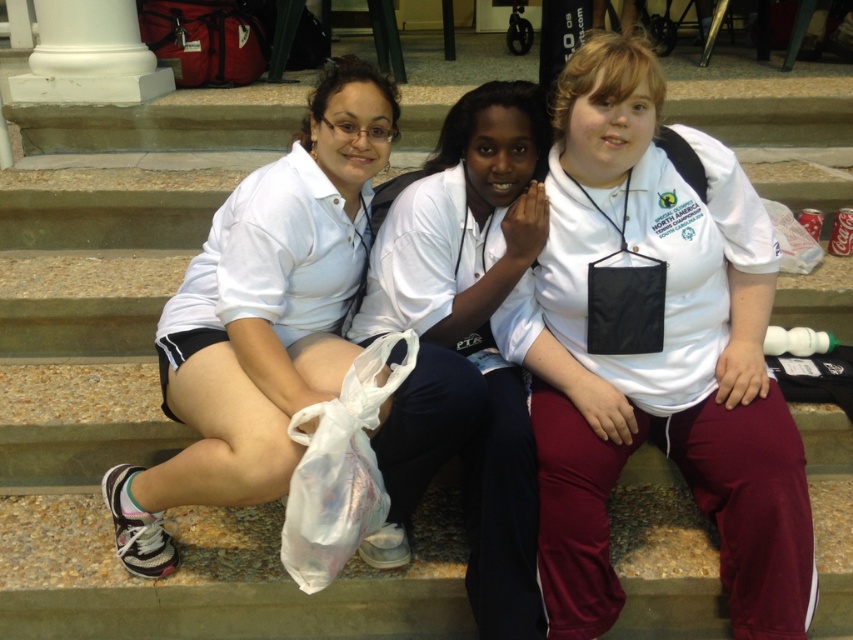
Question: Based on their relative distances, which object is nearer to the white cotton shirt at center?

Choices:
 (A) white matte shirt at center
 (B) white matte shorts at left

Answer: (A)

Question: Is white matte shorts at lower left positioned before white cotton shirt at center?

Choices:
 (A) yes
 (B) no

Answer: (A)

Question: Can you confirm if white matte shirt at center is positioned to the right of white matte shorts at lower left?

Choices:
 (A) no
 (B) yes

Answer: (B)

Question: Among these objects, which one is nearest to the camera?

Choices:
 (A) white matte shorts at left
 (B) white matte shirt at center
 (C) white cotton shirt at center

Answer: (C)

Question: Does white matte shirt at center have a larger size compared to white matte shorts at lower left?

Choices:
 (A) no
 (B) yes

Answer: (A)

Question: Which object is farther from the camera taking this photo?

Choices:
 (A) white matte shorts at left
 (B) white matte shirt at center
 (C) white matte shorts at lower left
 (D) white cotton shirt at center

Answer: (A)